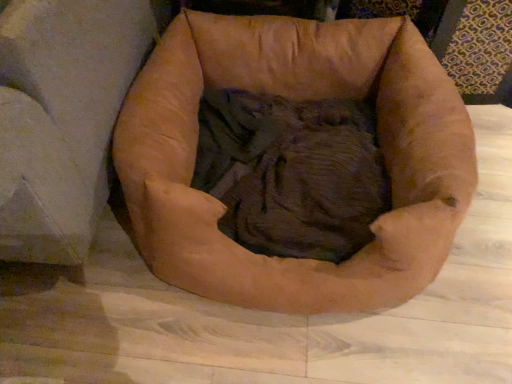
Describe the element at coordinates (61, 117) in the screenshot. I see `brown leather swivel chair at center` at that location.

This screenshot has height=384, width=512. What are the coordinates of `brown leather swivel chair at center` in the screenshot? It's located at (61, 117).

This screenshot has width=512, height=384. I want to click on brown leather swivel chair at center, so click(x=61, y=117).